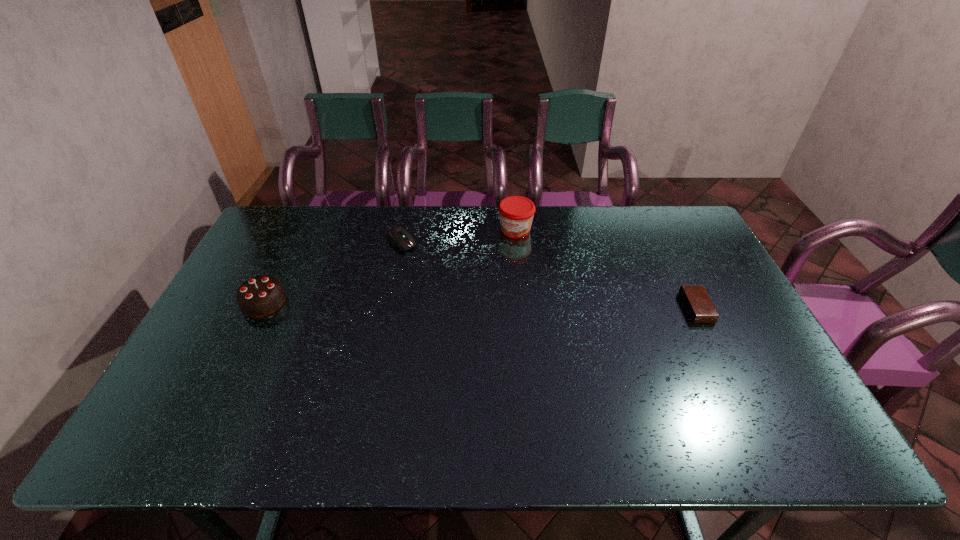
Locate an element on the screen. vacant position located on the label side of the jam is located at coordinates (480, 295).

The width and height of the screenshot is (960, 540). In order to click on vacant space located on the button of the second object from left to right in this screenshot , I will do click(476, 307).

You are a GUI agent. You are given a task and a screenshot of the screen. Output one action in this format:
    pyautogui.click(x=<x>, y=<y>)
    Task: Click on the vacant space located on the button of the second object from left to right
    Image resolution: width=960 pixels, height=540 pixels.
    Given the screenshot: What is the action you would take?
    coord(443,278)

Locate an element on the screen. vacant region located on the button of the second object from left to right is located at coordinates (461, 294).

Locate an element on the screen. Image resolution: width=960 pixels, height=540 pixels. jam at the far edge is located at coordinates (516, 213).

Locate an element on the screen. The width and height of the screenshot is (960, 540). computer equipment present at the far edge is located at coordinates (398, 236).

I want to click on object that is at the left edge, so tap(260, 296).

Find the location of a particular element. Image resolution: width=960 pixels, height=540 pixels. object that is at the right edge is located at coordinates (697, 302).

Locate an element on the screen. vacant space at the far edge of the desktop is located at coordinates (369, 237).

In the image, there is a desktop. Find the location of `vacant space at the near edge`. vacant space at the near edge is located at coordinates (707, 380).